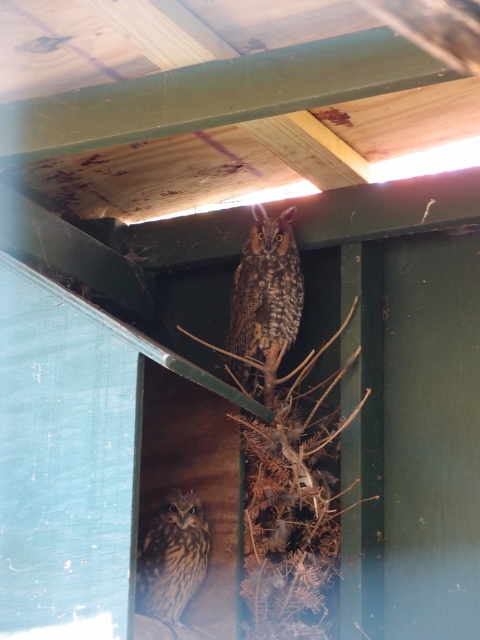
Is brown speckled owl at upper center wider than brown speckled owl at lower left?

Indeed, brown speckled owl at upper center has a greater width compared to brown speckled owl at lower left.

Between brown speckled owl at upper center and brown speckled owl at lower left, which one has less height?

With less height is brown speckled owl at lower left.

The height and width of the screenshot is (640, 480). What do you see at coordinates (266, 292) in the screenshot? I see `brown speckled owl at upper center` at bounding box center [266, 292].

The image size is (480, 640). I want to click on brown speckled owl at upper center, so click(x=266, y=292).